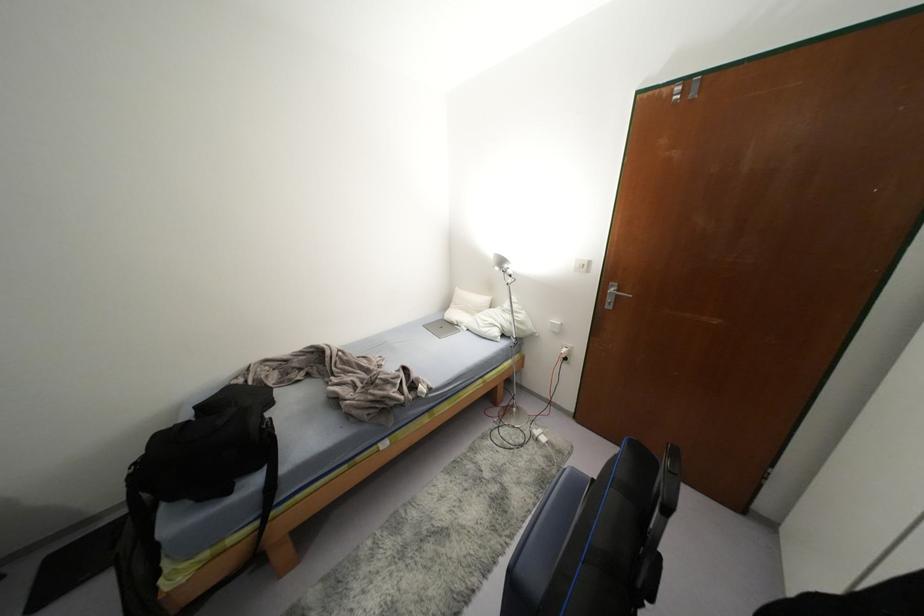
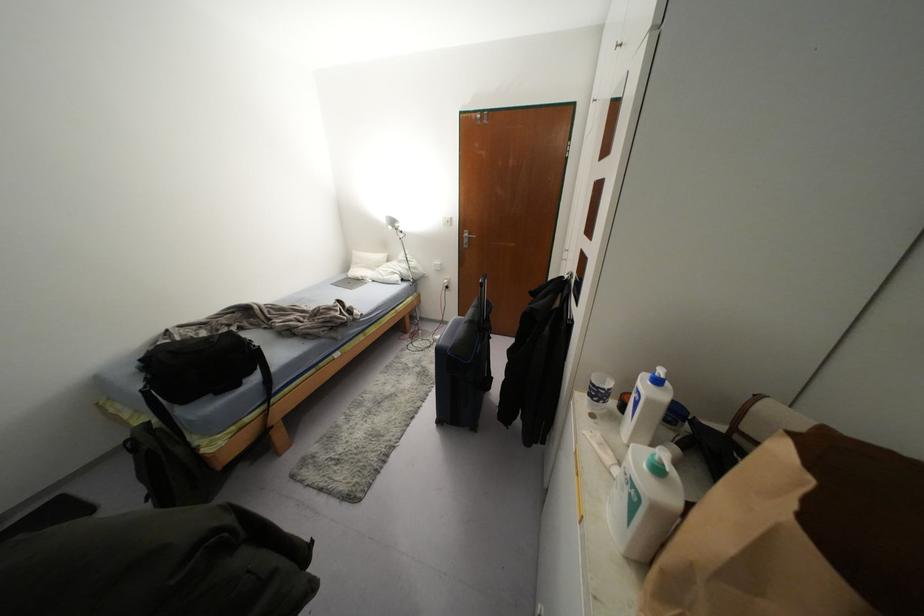
The point at (612,289) is marked in the first image. Where is the corresponding point in the second image?

(465, 233)